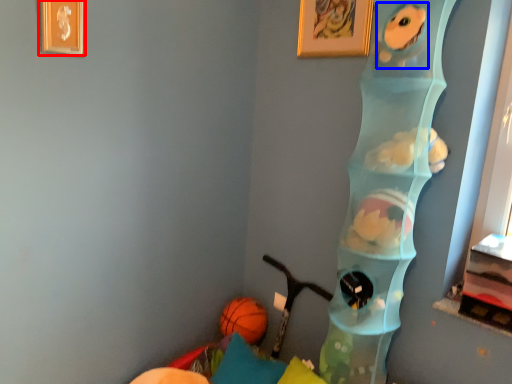
Question: Which object appears closest to the camera in this image, picture frame (highlighted by a red box) or animal (highlighted by a blue box)?

Choices:
 (A) picture frame
 (B) animal

Answer: (B)